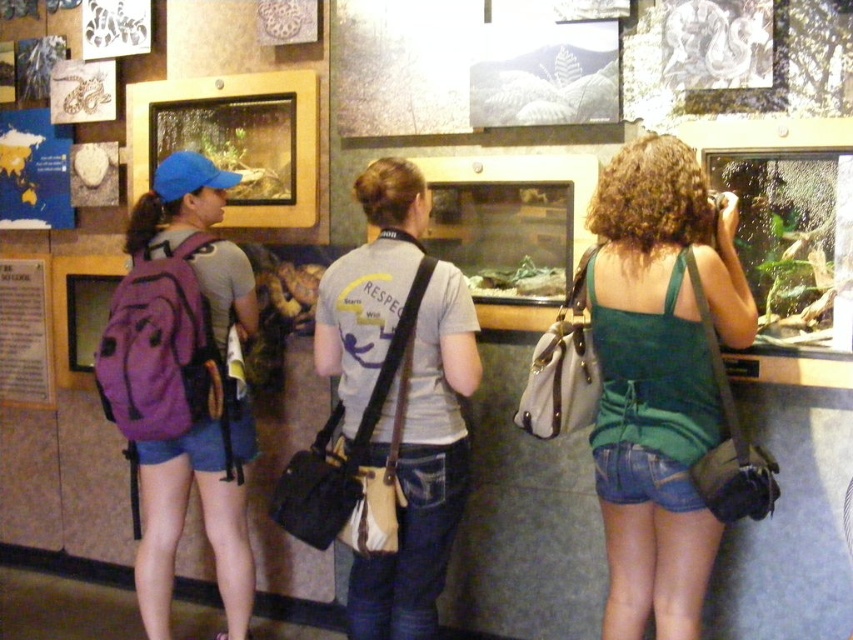
Measure the distance between green fabric tank top at center and camera.

green fabric tank top at center and camera are 1.87 meters apart from each other.

Is green fabric tank top at center shorter than gray cotton t-shirt at center?

Correct, green fabric tank top at center is not as tall as gray cotton t-shirt at center.

Where is `green fabric tank top at center`? This screenshot has width=853, height=640. green fabric tank top at center is located at coordinates (659, 378).

Locate an element on the screen. The width and height of the screenshot is (853, 640). green fabric tank top at center is located at coordinates (659, 378).

Between point (402, 557) and point (202, 492), which one is positioned in front?

Point (402, 557) is more forward.

Is gray cotton t-shirt at center bigger than purple fabric backpack at left?

Indeed, gray cotton t-shirt at center has a larger size compared to purple fabric backpack at left.

Identify the location of gray cotton t-shirt at center. (424, 472).

Is green fabric tank top at center positioned at the back of purple fabric backpack at left?

That is False.

Is green fabric tank top at center below purple fabric backpack at left?

Actually, green fabric tank top at center is above purple fabric backpack at left.

Describe the element at coordinates (659, 378) in the screenshot. The image size is (853, 640). I see `green fabric tank top at center` at that location.

In order to click on green fabric tank top at center in this screenshot , I will do `click(659, 378)`.